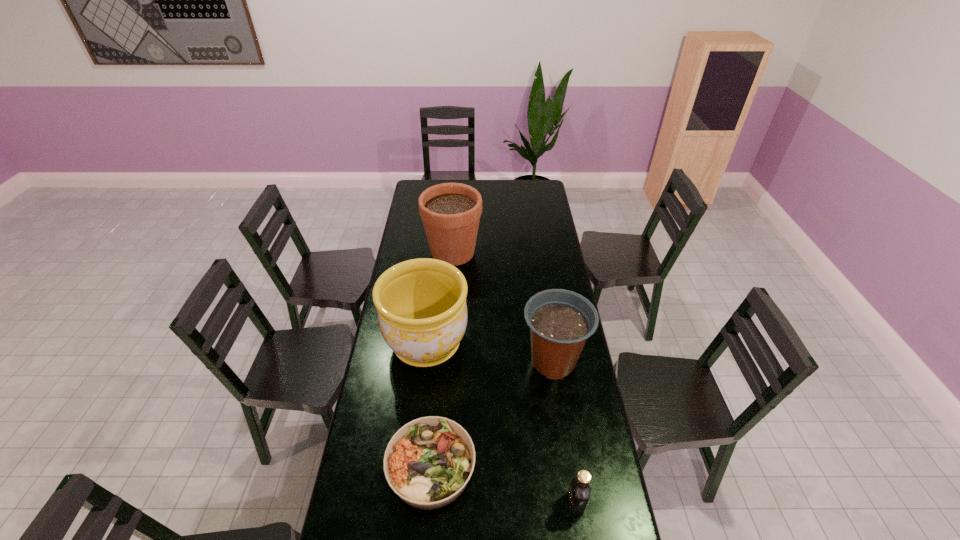
This screenshot has width=960, height=540. In order to click on free spot located on the back of the shortest object in this screenshot , I will do `click(441, 357)`.

Locate an element on the screen. salad plate situated at the left edge is located at coordinates (428, 462).

I want to click on flowerpot that is at the right edge, so click(x=560, y=321).

Locate an element on the screen. vodka situated at the right edge is located at coordinates (578, 495).

Image resolution: width=960 pixels, height=540 pixels. I want to click on free space at the far edge of the desktop, so click(517, 184).

The height and width of the screenshot is (540, 960). I want to click on vacant space at the left edge, so point(409,202).

In the image, there is a desktop. Find the location of `free space at the right edge`. free space at the right edge is located at coordinates (543, 227).

Identify the location of free spot at the far left corner of the desktop. The width and height of the screenshot is (960, 540). (419, 194).

The image size is (960, 540). Find the location of `vacant area between the vodka and the rightmost flowerpot`. vacant area between the vodka and the rightmost flowerpot is located at coordinates (564, 432).

You are a GUI agent. You are given a task and a screenshot of the screen. Output one action in this format:
    pyautogui.click(x=<x>, y=<y>)
    Task: Click on the free space between the shortest object and the third tallest object
    
    Given the screenshot: What is the action you would take?
    492,415